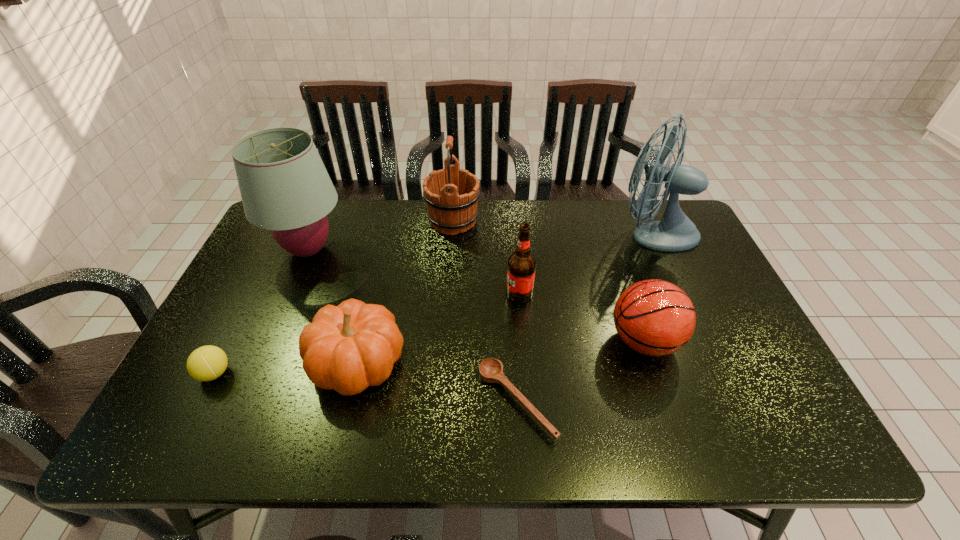
You are a GUI agent. You are given a task and a screenshot of the screen. Output one action in this format:
    pyautogui.click(x=<x>, y=<y>)
    Task: Click on the vacant space in between the fan and the wine bucket
    The image size is (960, 540).
    Given the screenshot: What is the action you would take?
    pyautogui.click(x=553, y=227)

Locate an element on the screen. Image resolution: width=960 pixels, height=540 pixels. free space between the sixth shortest object and the seventh tallest object is located at coordinates (334, 297).

The image size is (960, 540). I want to click on free space that is in between the second shortest object and the basketball, so click(429, 357).

Point out which object is positioned as the seventh nearest to the fifth nearest object. Please provide its 2D coordinates. Your answer should be formatted as a tuple, i.e. [(x, y)], where the tuple contains the x and y coordinates of a point satisfying the conditions above.

[(206, 363)]

Locate which object ranks third in proximity to the lampshade. Please provide its 2D coordinates. Your answer should be formatted as a tuple, i.e. [(x, y)], where the tuple contains the x and y coordinates of a point satisfying the conditions above.

[(206, 363)]

The width and height of the screenshot is (960, 540). What are the coordinates of `vacant space that satisfies the following two spatial constraints: 1. in front of the fan to blow air; 2. on the front side of the pumpkin` in the screenshot? It's located at point(711,362).

At what (x,y) coordinates should I click in order to perform the action: click on free space that satisfies the following two spatial constraints: 1. on the front side of the pumpkin; 2. on the left side of the lampshade. Please return your answer as a coordinate pair (x, y). Image resolution: width=960 pixels, height=540 pixels. Looking at the image, I should click on (260, 362).

I want to click on vacant space that satisfies the following two spatial constraints: 1. in front of the fan to blow air; 2. on the front side of the pumpkin, so click(x=711, y=362).